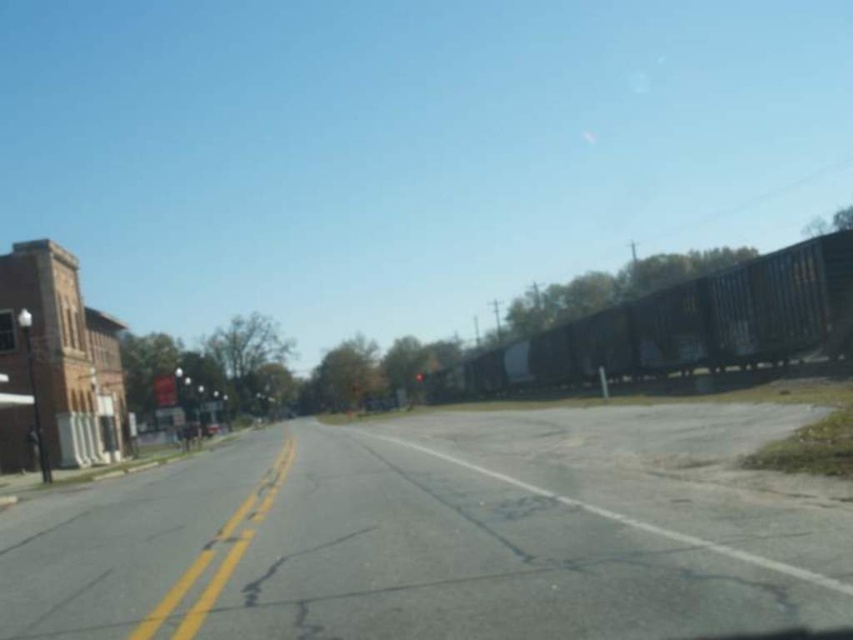
You are a delivery truck driver who needs to cross the gray asphalt train track at center. There is a metallic blue train car at right approaching the track. Based on the scene, can you safely cross the track before the train arrives?

The gray asphalt train track at center is smaller in size than the metallic blue train car at right, so the train car is likely longer and may take more time to pass the track. However, since the train car is already at the right side of the image, it might be moving away from the track. To ensure safety, you should wait until the train has completely passed or check for any signals indicating it is safe to cross.

You are a drone operator trying to capture a photo of the gray asphalt train track at center. The drone is currently hovering at the point with coordinates 0.5, 0.5. What direction should you move the drone to reach the train track?

The gray asphalt train track at center is located at coordinates (444, 532). Since the drone is at (426, 320), you should move it northeast to reach the train track.

You are a pedestrian standing at the edge of the two lane road. You see the gray asphalt train track at center and the metallic blue train car at right. Which object is closer to the road?

The metallic blue train car at right is closer to the road because the gray asphalt train track at center is located below it, meaning the train car is positioned above the tracks near the road level.